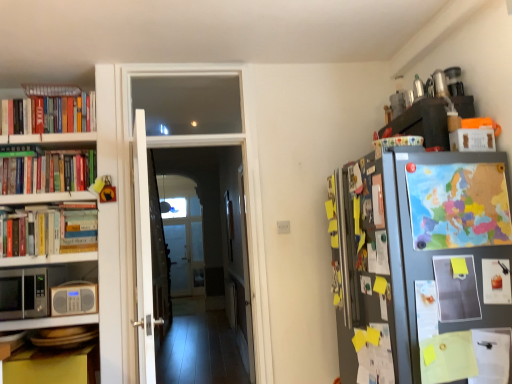
Question: Does colorful paper map at right, which is the second book from front to back, have a smaller size compared to white paper at right, the second book in the right-to-left sequence?

Choices:
 (A) no
 (B) yes

Answer: (A)

Question: Is white paper at right, placed as the first book when sorted from front to back, completely or partially inside colorful paper map at right, the fourth book viewed from the back?

Choices:
 (A) yes
 (B) no

Answer: (B)

Question: Is colorful paper map at right, the fourth book viewed from the back, facing away from white paper at right, placed as the first book when sorted from front to back?

Choices:
 (A) yes
 (B) no

Answer: (B)

Question: From the image's perspective, is colorful paper map at right, which is the second book from front to back, over white paper at right, placed as the first book when sorted from front to back?

Choices:
 (A) no
 (B) yes

Answer: (B)

Question: Is colorful paper map at right, the fourth book viewed from the back, directly adjacent to white paper at right, which ranks as the 4th book in left-to-right order?

Choices:
 (A) yes
 (B) no

Answer: (B)

Question: From a real-world perspective, relative to hardcover books at left, the 2th book when ordered from back to front, is white wooden door at center, the first door when ordered from left to right, vertically above or below?

Choices:
 (A) above
 (B) below

Answer: (B)

Question: Considering the positions of white wooden door at center, the first door when ordered from left to right, and hardcover books at left, positioned as the fourth book in front-to-back order, in the image, is white wooden door at center, the first door when ordered from left to right, taller or shorter than hardcover books at left, positioned as the fourth book in front-to-back order,?

Choices:
 (A) tall
 (B) short

Answer: (A)

Question: Looking at their shapes, would you say white wooden door at center, the first door when ordered from left to right, is wider or thinner than hardcover books at left, the 2th book when ordered from back to front?

Choices:
 (A) wide
 (B) thin

Answer: (A)

Question: Choose the correct answer: Is white wooden door at center, arranged as the 3th door when viewed from the right, inside hardcover books at left, the 2th book when ordered from back to front, or outside it?

Choices:
 (A) outside
 (B) inside

Answer: (A)

Question: Looking at the image, does white wooden door at center seem bigger or smaller compared to white wooden door at center, the first door when ordered from left to right?

Choices:
 (A) big
 (B) small

Answer: (B)

Question: In terms of width, does white wooden door at center look wider or thinner when compared to white wooden door at center, the first door when ordered from left to right?

Choices:
 (A) wide
 (B) thin

Answer: (B)

Question: Considering the positions of white wooden door at center and white wooden door at center, arranged as the 3th door when viewed from the right, in the image, is white wooden door at center taller or shorter than white wooden door at center, arranged as the 3th door when viewed from the right,?

Choices:
 (A) short
 (B) tall

Answer: (B)

Question: Choose the correct answer: Is white wooden door at center inside white wooden door at center, arranged as the 3th door when viewed from the right, or outside it?

Choices:
 (A) outside
 (B) inside

Answer: (A)

Question: Considering the relative positions of beige plastic radio at lower left and white wooden door at center, which is the 1th door from right to left, in the image provided, is beige plastic radio at lower left to the left or to the right of white wooden door at center, which is the 1th door from right to left,?

Choices:
 (A) right
 (B) left

Answer: (B)

Question: Is beige plastic radio at lower left in front of or behind white wooden door at center, which is the 1th door from right to left, in the image?

Choices:
 (A) behind
 (B) front

Answer: (B)